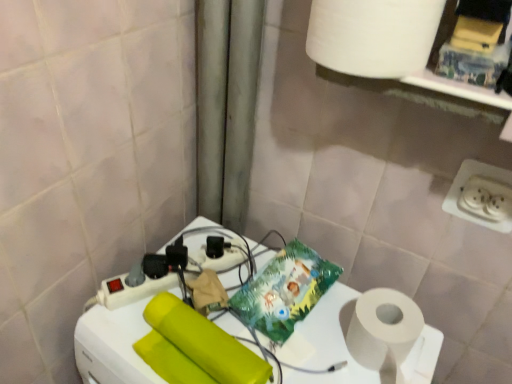
Question: Looking at the image, does white matte paper towel at upper right seem bigger or smaller compared to matte yellow toilet paper at center?

Choices:
 (A) small
 (B) big

Answer: (B)

Question: Considering the positions of point (409, 11) and point (267, 365), is point (409, 11) closer or farther from the camera than point (267, 365)?

Choices:
 (A) closer
 (B) farther

Answer: (A)

Question: Which of these objects is positioned farthest from the matte yellow toilet paper at center?

Choices:
 (A) white plastic power strip at center
 (B) white plastic power plugs and sockets at lower right
 (C) white matte paper towel at upper right

Answer: (B)

Question: Which object is positioned closest to the white plastic power plugs and sockets at lower right?

Choices:
 (A) white matte paper towel at upper right
 (B) white plastic power strip at center
 (C) matte yellow toilet paper at center

Answer: (A)